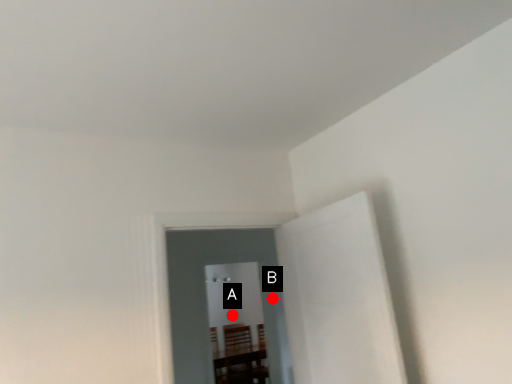
Question: Two points are circled on the image, labeled by A and B beside each circle. Which point is closer to the camera?

Choices:
 (A) A is closer
 (B) B is closer

Answer: (B)